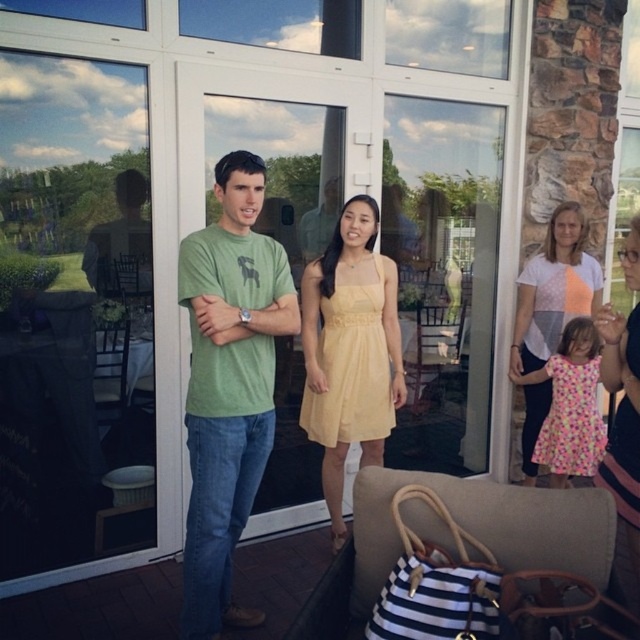
Question: Considering the real-world distances, which object is closest to the floral cotton dress at lower right?

Choices:
 (A) yellow satin dress at center
 (B) matte pink dress at lower right
 (C) green t-shirt at center

Answer: (B)

Question: Which of these objects is positioned farthest from the matte pink dress at lower right?

Choices:
 (A) yellow satin dress at center
 (B) yellow chiffon dress at center

Answer: (A)

Question: Can you confirm if green t-shirt at center is positioned above yellow satin dress at center?

Choices:
 (A) no
 (B) yes

Answer: (A)

Question: Is green t-shirt at center positioned before floral cotton dress at lower right?

Choices:
 (A) no
 (B) yes

Answer: (B)

Question: Does matte pink dress at lower right have a larger size compared to floral cotton dress at lower right?

Choices:
 (A) yes
 (B) no

Answer: (B)

Question: Which object is positioned farthest from the yellow chiffon dress at center?

Choices:
 (A) green t-shirt at center
 (B) yellow satin dress at center

Answer: (A)